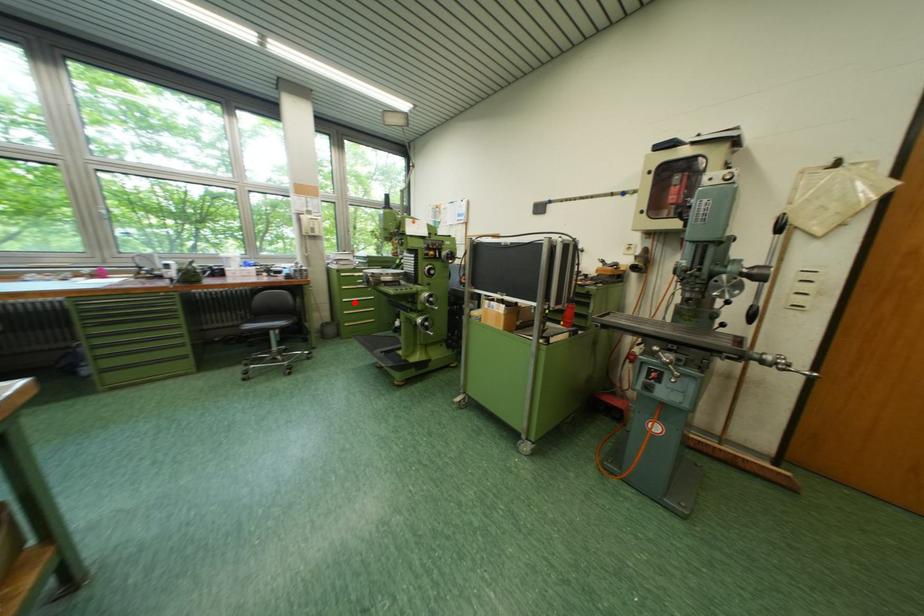
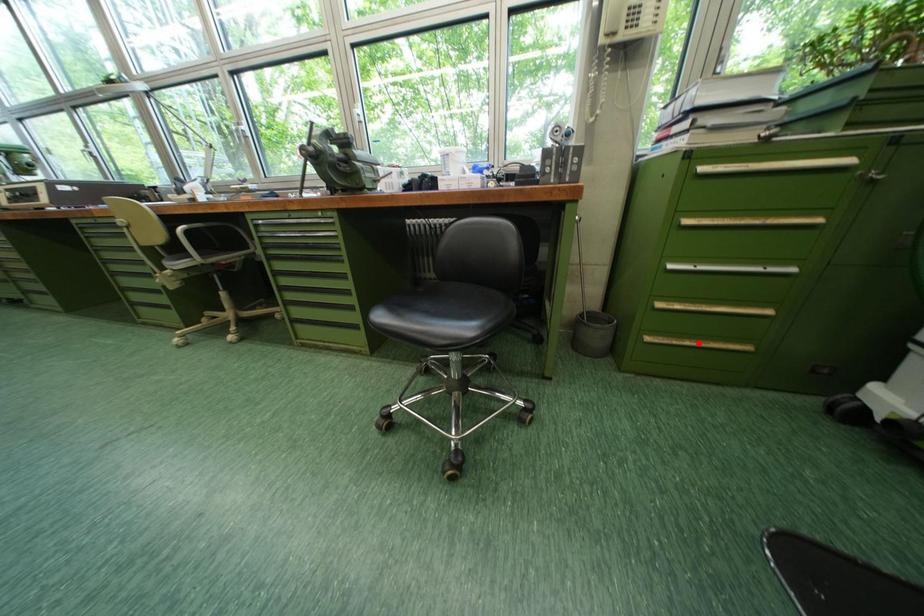
I am providing you with two images of the same scene from different viewpoints. A red point is marked on the first image and another point is marked on the second image. Is the marked point in image1 the same physical position as the marked point in image2?

No